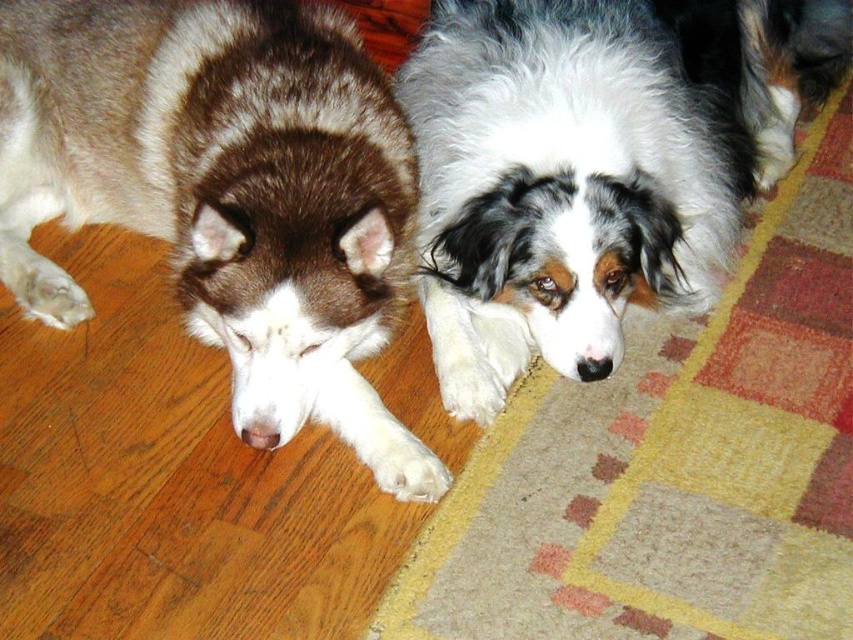
From the picture: You are a dog trainer observing two dogs lying on the wooden floor. You see the brown and white fur at left and the fluffy white coat with black and brown markings at right. Which dog is closer to the camera?

The brown and white fur at left is closer to the camera because they are 1.40 meters apart, but the description does not specify their distance from the camera.

You are a photographer setting up a shoot in the room. You need to position a light source so that it illuminates the brown and white fur at left and the white fluffy dog at center without casting shadows on the wooden floor. Based on their positions, where should you place the light source relative to the dogs?

The brown and white fur at left is located below the white fluffy dog at center. To avoid casting shadows on the wooden floor, the light source should be placed above both the brown and white fur at left and the white fluffy dog at center, such as from an overhead position like a ceiling light or a boom arm.